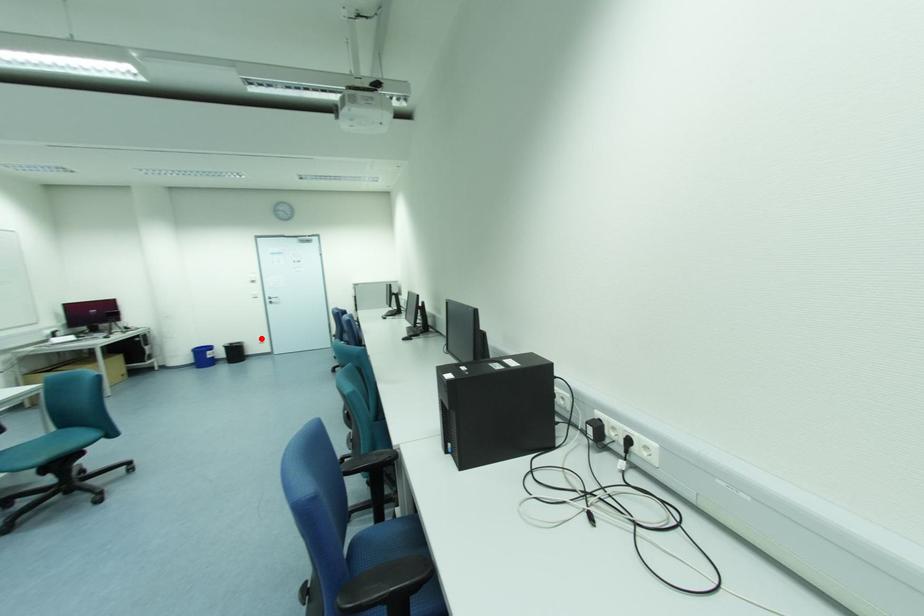
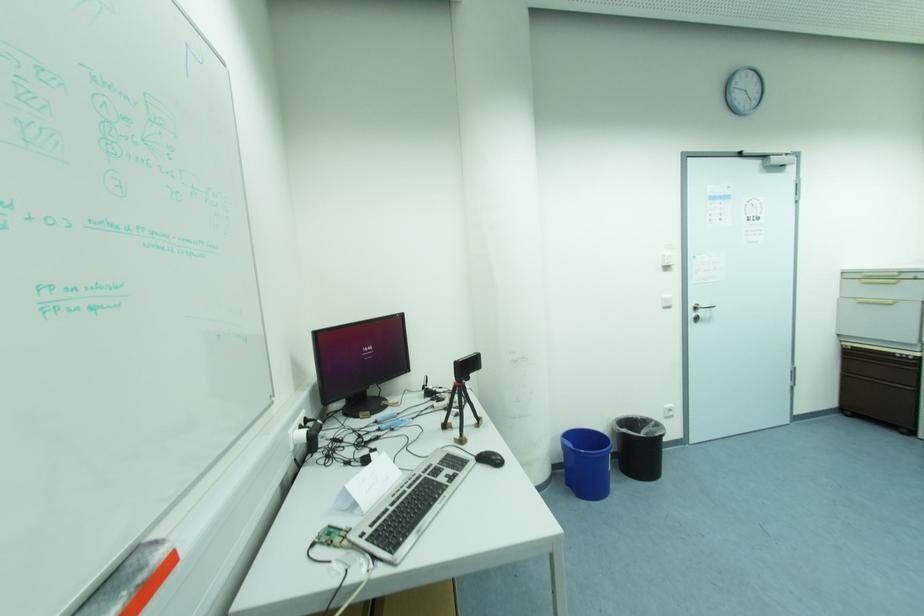
Question: I am providing you with two images of the same scene from different viewpoints. Given a red point in image1, look at the same physical point in image2. Is it:

Choices:
 (A) Closer to the viewpoint
 (B) Farther from the viewpoint

Answer: (B)